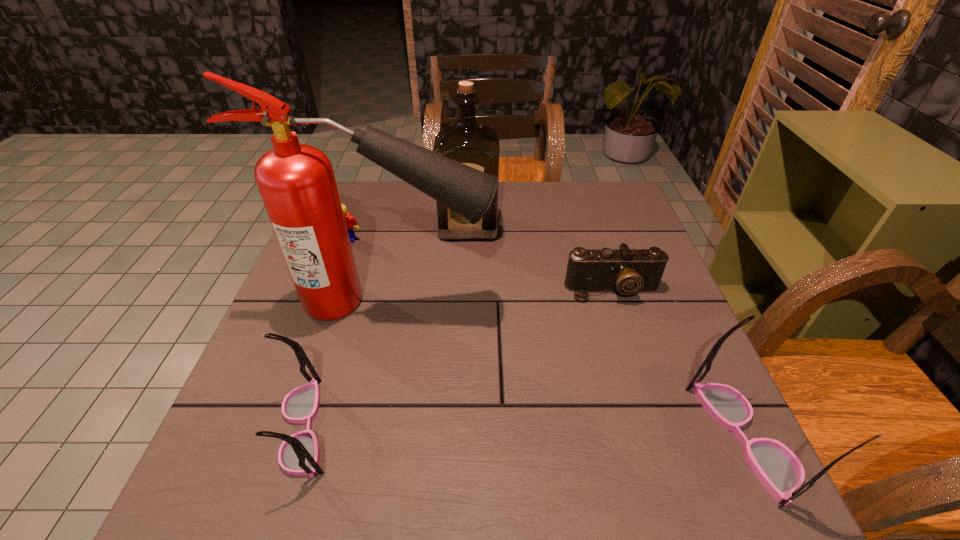
Where is `the shorter spectacles`? This screenshot has width=960, height=540. the shorter spectacles is located at coordinates (298, 455).

Where is `the third shortest object`? The height and width of the screenshot is (540, 960). the third shortest object is located at coordinates (298, 455).

Identify the location of the third tallest object. (779, 470).

Identify the location of the taller spectacles. (779, 470).

The height and width of the screenshot is (540, 960). In order to click on camera in this screenshot , I will do `click(625, 270)`.

Locate an element on the screen. liquor is located at coordinates (476, 145).

You are a GUI agent. You are given a task and a screenshot of the screen. Output one action in this format:
    pyautogui.click(x=<x>, y=<y>)
    Task: Click on the Lego
    This screenshot has height=540, width=960.
    Given the screenshot: What is the action you would take?
    pyautogui.click(x=350, y=220)

Where is `the tallest object`? Image resolution: width=960 pixels, height=540 pixels. the tallest object is located at coordinates (297, 184).

Identify the location of vacant area situated on the back of the fourth tallest object. This screenshot has width=960, height=540. (326, 361).

What are the coordinates of `vacant space situated on the left of the right spectacles` in the screenshot? It's located at (548, 438).